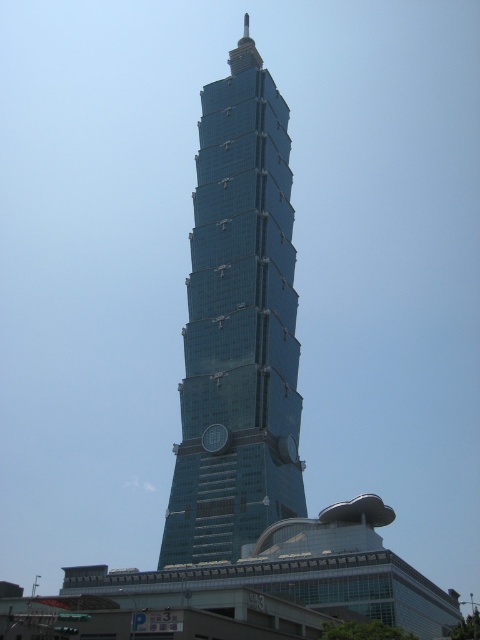
You are standing in front of the Taipei 101 complex and notice both the glassy blue skyscraper at center and the metallic clock at center. Which object is closer to you based on their positions?

The glassy blue skyscraper at center is closer to you because it is positioned in front of the metallic clock at center.

Consider the image. You are standing in front of the glassy blue skyscraper at center. If you want to take a photo of it with your smartphone, which has a maximum focus range of 50 meters, will the skyscraper be in focus?

The glassy blue skyscraper at center is 71.03 meters away from camera, which exceeds the smartphone camera maximum focus range of 50 meters. Therefore, the skyscraper will not be in focus.

You are standing in front of the Taipei 101 complex and need to determine which object is taller between the glassy blue skyscraper at center and the metallic clock at center. Based on the scene description, which one is taller?

The glassy blue skyscraper at center is taller than the metallic clock at center.